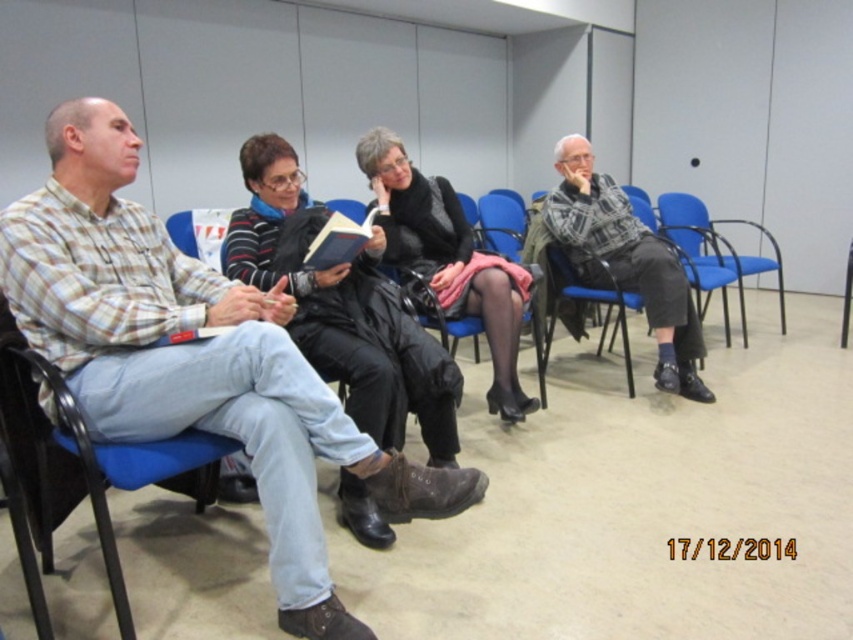
Consider the image. Is blue fabric chair at left positioned at the back of blue plastic chair at center?

That is False.

Who is more forward, (119, 592) or (677, 204)?

Point (119, 592)

Between point (21, 394) and point (704, 241), which one is positioned behind?

Point (704, 241)

At what (x,y) coordinates should I click in order to perform the action: click on blue fabric chair at left. Please return your answer as a coordinate pair (x, y). This screenshot has width=853, height=640. Looking at the image, I should click on (103, 461).

I want to click on plaid cotton shirt at left, so click(x=192, y=356).

Is point (206, 301) positioned behind point (334, 264)?

No, it is in front of (334, 264).

Which is behind, point (91, 221) or point (364, 248)?

Positioned behind is point (364, 248).

You are a GUI agent. You are given a task and a screenshot of the screen. Output one action in this format:
    pyautogui.click(x=<x>, y=<y>)
    Task: Click on the plaid cotton shirt at left
    This screenshot has height=640, width=853.
    Given the screenshot: What is the action you would take?
    pyautogui.click(x=192, y=356)

Can you confirm if plaid cotton shirt at left is positioned to the right of black leather jacket at center?

Incorrect, plaid cotton shirt at left is not on the right side of black leather jacket at center.

Between point (15, 301) and point (415, 182), which one is positioned in front?

Point (15, 301) is more forward.

Which is in front, point (57, 349) or point (500, 392)?

Point (57, 349) is in front.

The image size is (853, 640). I want to click on plaid cotton shirt at left, so click(192, 356).